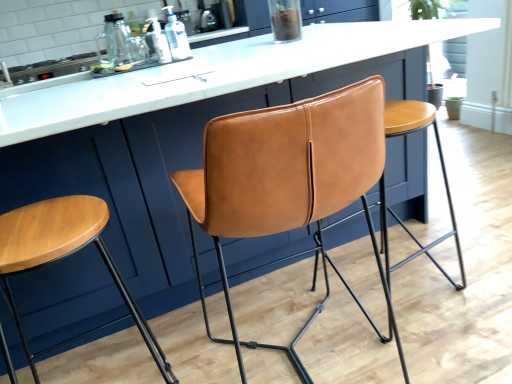
At what (x,y) coordinates should I click in order to perform the action: click on free location to the right of matte leather stool at center, which is the 1th stool in right-to-left order. Please return your answer as a coordinate pair (x, y). This screenshot has width=512, height=384. Looking at the image, I should click on (470, 264).